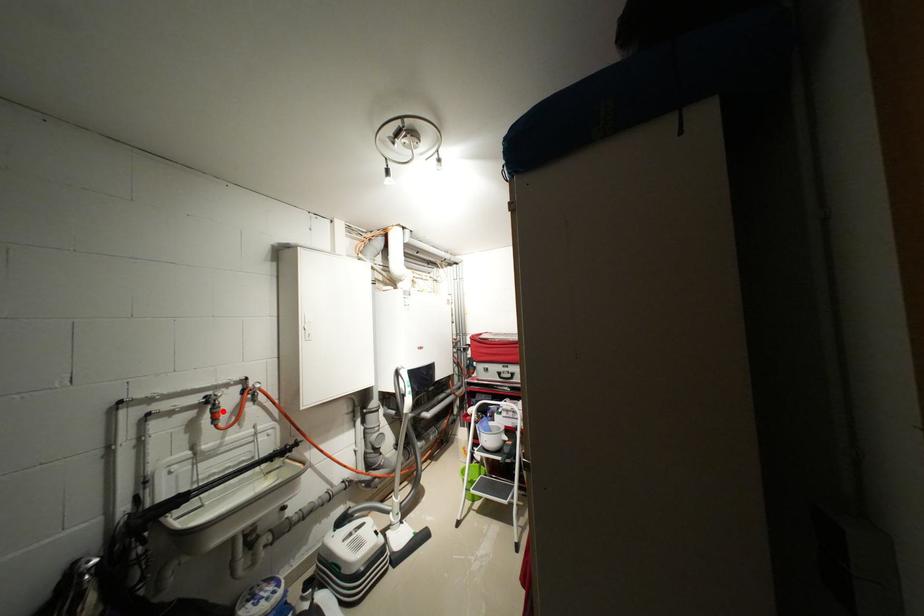
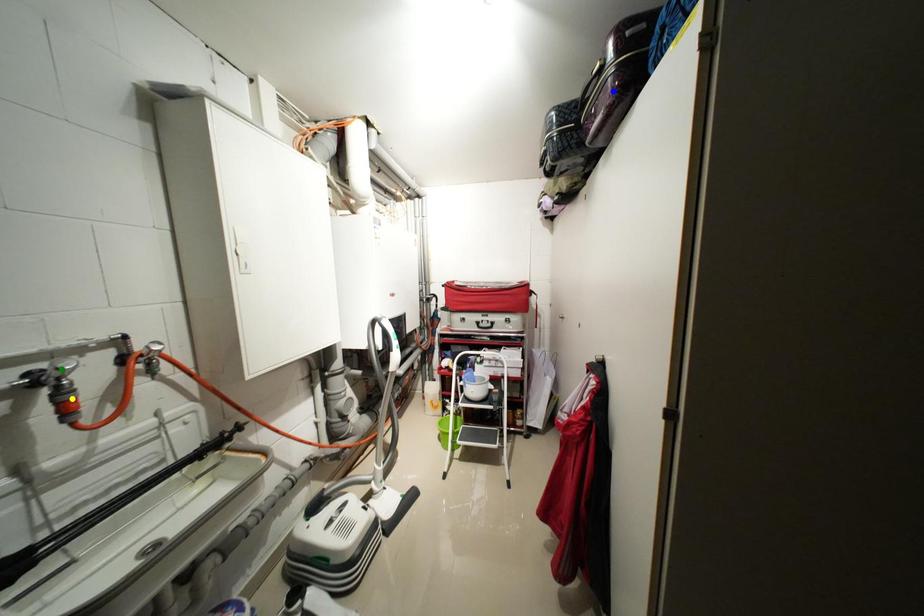
Question: I am providing you with two images of the same scene from different viewpoints. A red point is marked on the first image. You are given multiple points on the second image. In image 2, which mark is for the same physical point as the one in image 1?

Choices:
 (A) blue point
 (B) green point
 (C) yellow point

Answer: (C)